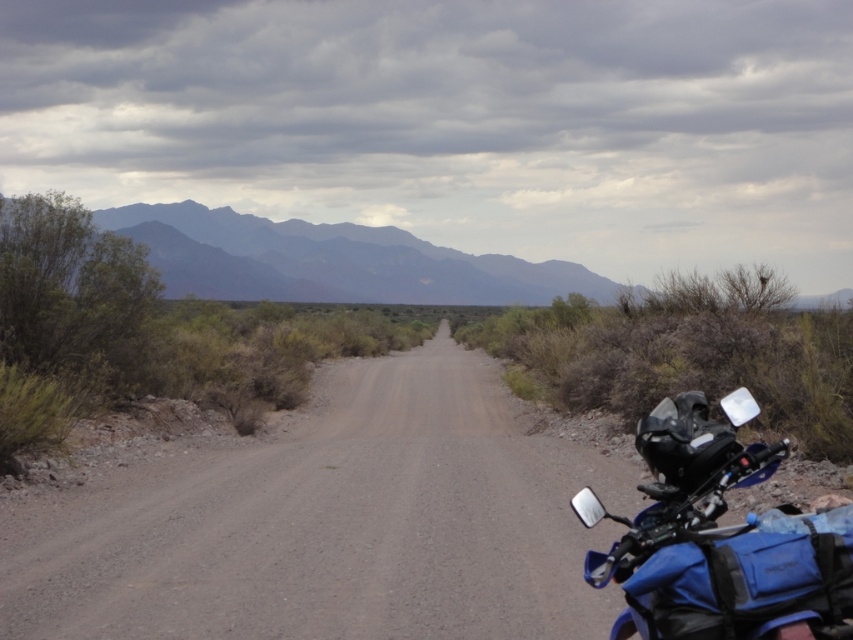
Question: Which is nearer to the blue matte/synthetic motorcycle at right?

Choices:
 (A) dusty gravel road at center
 (B) gray textured mountains at upper center

Answer: (A)

Question: Is dusty gravel road at center smaller than gray textured mountains at upper center?

Choices:
 (A) yes
 (B) no

Answer: (A)

Question: Can you confirm if dusty gravel road at center is positioned to the left of blue matte/synthetic motorcycle at right?

Choices:
 (A) no
 (B) yes

Answer: (B)

Question: Can you confirm if dusty gravel road at center is wider than blue matte/synthetic motorcycle at right?

Choices:
 (A) no
 (B) yes

Answer: (B)

Question: Which object appears closest to the camera in this image?

Choices:
 (A) dusty gravel road at center
 (B) gray textured mountains at upper center
 (C) blue matte/synthetic motorcycle at right

Answer: (C)

Question: Which object is positioned closest to the dusty gravel road at center?

Choices:
 (A) blue matte/synthetic motorcycle at right
 (B) gray textured mountains at upper center

Answer: (A)